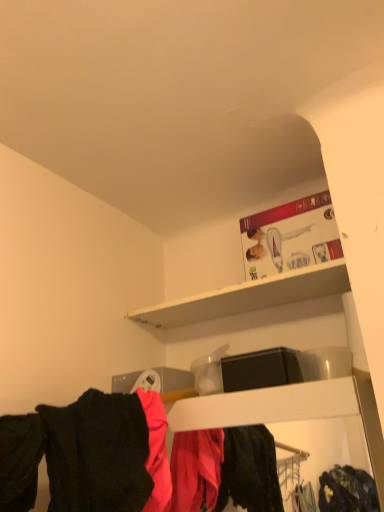
Question: Considering the positions of point (132, 486) and point (246, 294), is point (132, 486) closer or farther from the camera than point (246, 294)?

Choices:
 (A) farther
 (B) closer

Answer: (B)

Question: Based on their sizes in the image, would you say matte black clothing at lower center is bigger or smaller than white matte shelf at upper center?

Choices:
 (A) big
 (B) small

Answer: (A)

Question: Based on their relative distances, which object is farther from the white matte shelf at upper center?

Choices:
 (A) matte black clothing at lower center
 (B) black matte shirt at lower left

Answer: (B)

Question: Estimate the real-world distances between objects in this image. Which object is closer to the white matte shelf at upper center?

Choices:
 (A) black matte shirt at lower left
 (B) matte black clothing at lower center

Answer: (B)